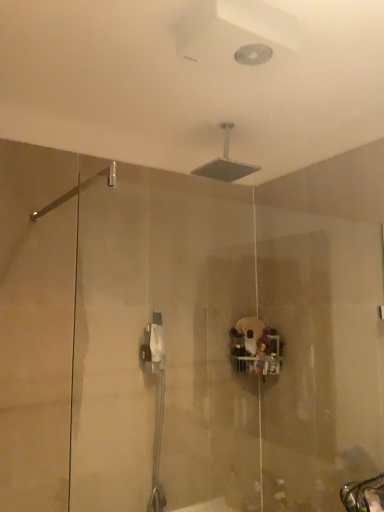
Question: From the image's perspective, is matte silver showerhead at upper center, acting as the first shower starting from the right, positioned above or below silver metallic grab bar at upper left, the 2th shower in the right-to-left sequence?

Choices:
 (A) above
 (B) below

Answer: (A)

Question: Is point (208, 166) closer or farther from the camera than point (94, 175)?

Choices:
 (A) closer
 (B) farther

Answer: (B)

Question: Looking at the image, does matte silver showerhead at upper center, the 1th shower in the back-to-front sequence, seem bigger or smaller compared to silver metallic grab bar at upper left, the 2th shower viewed from the top?

Choices:
 (A) small
 (B) big

Answer: (B)

Question: From a real-world perspective, is silver metallic grab bar at upper left, which ranks as the first shower in left-to-right order, positioned above or below matte silver showerhead at upper center, acting as the second shower starting from the front?

Choices:
 (A) above
 (B) below

Answer: (B)

Question: Considering the positions of silver metallic grab bar at upper left, which ranks as the first shower in left-to-right order, and matte silver showerhead at upper center, acting as the second shower starting from the front, in the image, is silver metallic grab bar at upper left, which ranks as the first shower in left-to-right order, wider or thinner than matte silver showerhead at upper center, acting as the second shower starting from the front,?

Choices:
 (A) wide
 (B) thin

Answer: (A)

Question: In the image, is silver metallic grab bar at upper left, which ranks as the first shower in left-to-right order, on the left side or the right side of matte silver showerhead at upper center, acting as the second shower starting from the front?

Choices:
 (A) left
 (B) right

Answer: (A)

Question: From the image's perspective, is silver metallic grab bar at upper left, the 2th shower viewed from the top, located above or below matte silver showerhead at upper center, acting as the second shower starting from the front?

Choices:
 (A) above
 (B) below

Answer: (B)